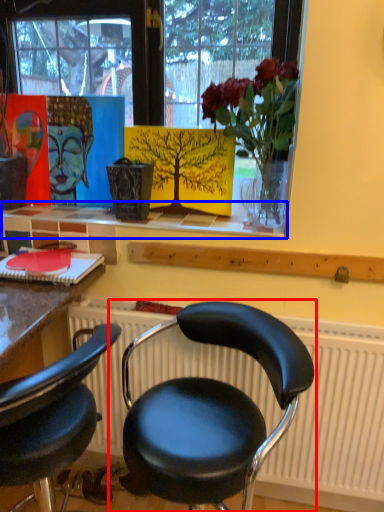
Question: Which object is further to the camera taking this photo, chair (highlighted by a red box) or window sill (highlighted by a blue box)?

Choices:
 (A) chair
 (B) window sill

Answer: (B)